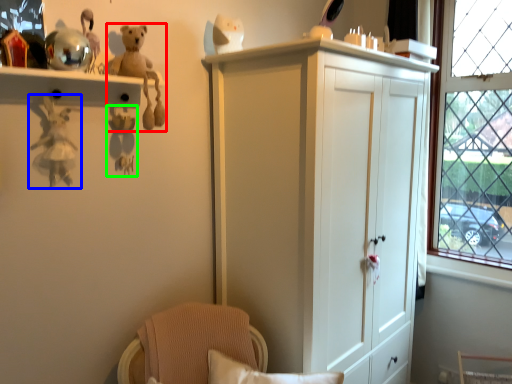
Question: Considering the real-world distances, which object is closest to toy (highlighted by a red box)? toy (highlighted by a blue box) or toy (highlighted by a green box).

Choices:
 (A) toy
 (B) toy

Answer: (B)